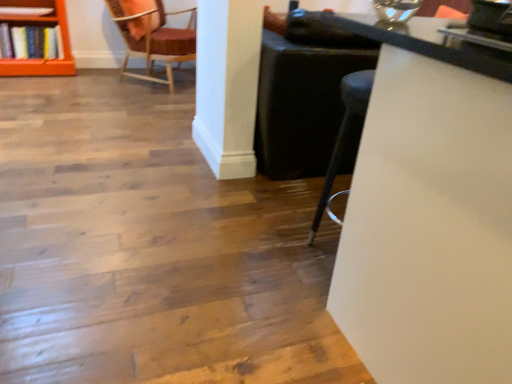
Question: Is orange wood shelf at upper left at the back of white glossy table at upper right?

Choices:
 (A) yes
 (B) no

Answer: (A)

Question: Is white glossy table at upper right thinner than orange wood shelf at upper left?

Choices:
 (A) no
 (B) yes

Answer: (A)

Question: Can you confirm if white glossy table at upper right is taller than orange wood shelf at upper left?

Choices:
 (A) no
 (B) yes

Answer: (B)

Question: Is white glossy table at upper right not inside orange wood shelf at upper left?

Choices:
 (A) no
 (B) yes

Answer: (B)

Question: Considering the relative positions of white glossy table at upper right and orange wood shelf at upper left in the image provided, is white glossy table at upper right in front of orange wood shelf at upper left?

Choices:
 (A) yes
 (B) no

Answer: (A)

Question: From the image's perspective, is orange wood shelf at upper left above or below white glossy table at upper right?

Choices:
 (A) above
 (B) below

Answer: (A)

Question: Considering the positions of orange wood shelf at upper left and white glossy table at upper right in the image, is orange wood shelf at upper left wider or thinner than white glossy table at upper right?

Choices:
 (A) thin
 (B) wide

Answer: (A)

Question: From their relative heights in the image, would you say orange wood shelf at upper left is taller or shorter than white glossy table at upper right?

Choices:
 (A) tall
 (B) short

Answer: (B)

Question: Is orange wood shelf at upper left inside the boundaries of white glossy table at upper right, or outside?

Choices:
 (A) outside
 (B) inside

Answer: (A)

Question: Is orange wood shelf at upper left situated inside velvet-like burgundy chair at upper left or outside?

Choices:
 (A) outside
 (B) inside

Answer: (A)

Question: Relative to velvet-like burgundy chair at upper left, is orange wood shelf at upper left in front or behind?

Choices:
 (A) behind
 (B) front

Answer: (A)

Question: Visually, is orange wood shelf at upper left positioned to the left or to the right of velvet-like burgundy chair at upper left?

Choices:
 (A) left
 (B) right

Answer: (A)

Question: From a real-world perspective, is orange wood shelf at upper left above or below velvet-like burgundy chair at upper left?

Choices:
 (A) below
 (B) above

Answer: (A)

Question: In the image, is white glossy table at upper right positioned in front of or behind orange wood shelf at upper left?

Choices:
 (A) behind
 (B) front

Answer: (B)

Question: From the image's perspective, is white glossy table at upper right positioned above or below orange wood shelf at upper left?

Choices:
 (A) below
 (B) above

Answer: (A)